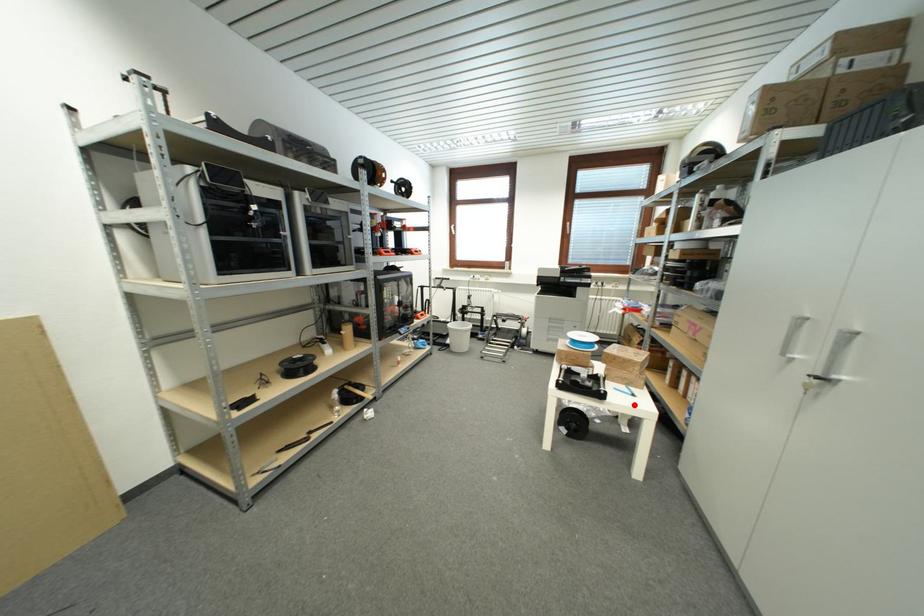
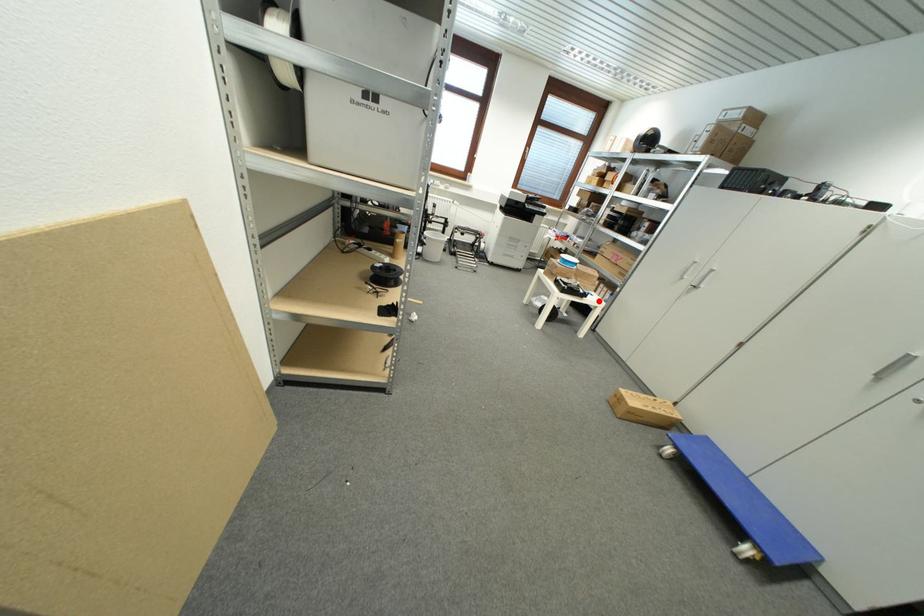
Consider the image. I am providing you with two images of the same scene from different viewpoints. A red point is marked on the first image and another point is marked on the second image. Are the points marked in image1 and image2 representing the same 3D position?

Yes